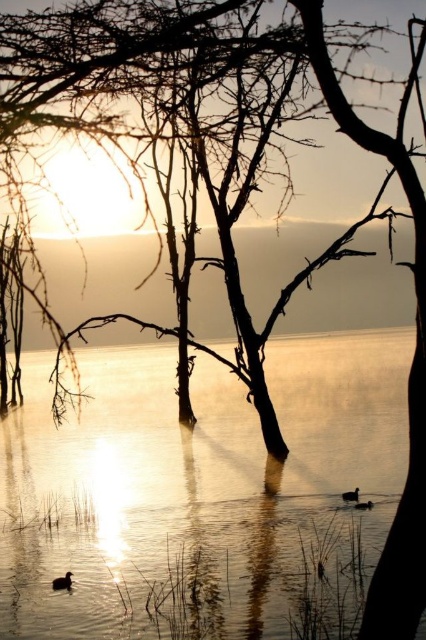
Question: Is silvery reflective water at center wider than dark brown feathered duck at center?

Choices:
 (A) yes
 (B) no

Answer: (A)

Question: Which of these objects is positioned farthest from the brown matte duck at lower center?

Choices:
 (A) brown matte duck at lower left
 (B) silvery reflective water at center
 (C) dark brown feathered duck at center

Answer: (A)

Question: Which object appears closest to the camera in this image?

Choices:
 (A) brown matte duck at lower center
 (B) dark brown feathered duck at center
 (C) brown matte duck at lower left

Answer: (C)

Question: Which point appears closest to the camera in this image?

Choices:
 (A) (344, 499)
 (B) (57, 595)

Answer: (B)

Question: Does brown matte duck at lower left appear on the left side of dark brown feathered duck at center?

Choices:
 (A) no
 (B) yes

Answer: (B)

Question: Is the position of brown matte duck at lower left more distant than that of brown matte duck at lower center?

Choices:
 (A) no
 (B) yes

Answer: (A)